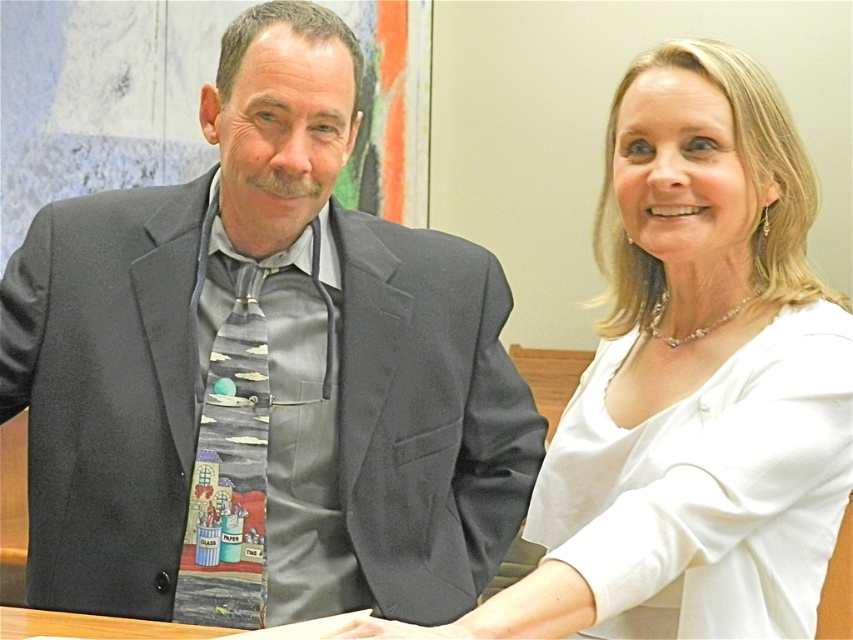
Please provide the exact coordinates of the white satin blouse at center in the image.

The white satin blouse at center is located at coordinates point (x=691, y=384).

You are a tailor measuring garments for alterations. You have a standard mannequin that can only accommodate items up to 40 inches in width. You need to determine if both the matte gray suit at left and the white satin blouse at center can fit on the mannequin. Which garment might not fit based on their widths?

The matte gray suit at left has a larger width than the white satin blouse at center. Since the mannequin can only accommodate up to 40 inches, the matte gray suit at left might not fit if its width exceeds the mannequin limit.